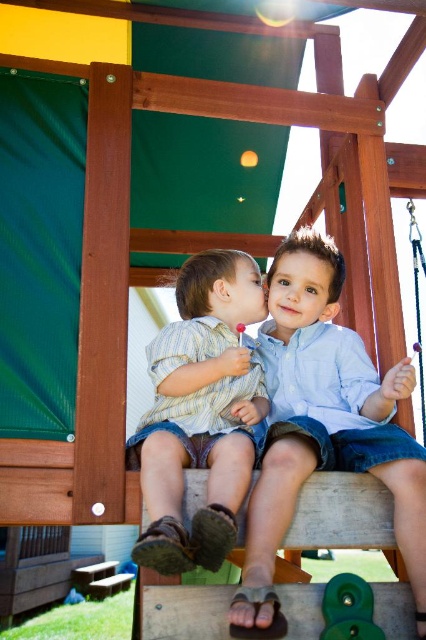
Between light blue denim shorts at center and striped cotton shirt at center, which one appears on the right side from the viewer's perspective?

light blue denim shorts at center

Can you confirm if light blue denim shorts at center is bigger than striped cotton shirt at center?

Correct, light blue denim shorts at center is larger in size than striped cotton shirt at center.

What are the coordinates of `light blue denim shorts at center` in the screenshot? It's located at (322, 426).

Who is more distant from viewer, (181, 360) or (348, 611)?

The point (181, 360) is behind.

Does point (224, 476) come closer to viewer compared to point (333, 577)?

Yes, it is.

The height and width of the screenshot is (640, 426). Find the location of `striped cotton shirt at center`. striped cotton shirt at center is located at coordinates (199, 412).

Does light blue denim shorts at center have a larger size compared to green rubber toy at lower center?

Correct, light blue denim shorts at center is larger in size than green rubber toy at lower center.

Which is more to the right, light blue denim shorts at center or green rubber toy at lower center?

green rubber toy at lower center is more to the right.

At what (x,y) coordinates should I click in order to perform the action: click on light blue denim shorts at center. Please return your answer as a coordinate pair (x, y). The height and width of the screenshot is (640, 426). Looking at the image, I should click on (322, 426).